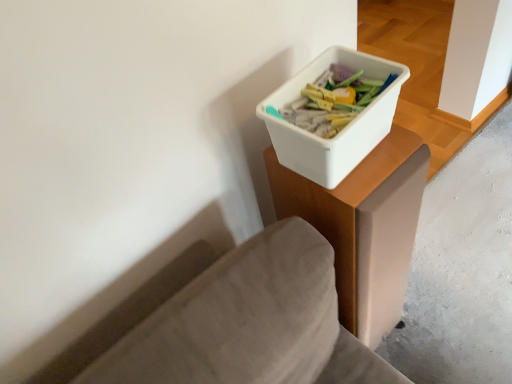
Question: Would you say white plastic container at upper right is a long distance from smooth concrete at lower right?

Choices:
 (A) yes
 (B) no

Answer: (B)

Question: From the image's perspective, is white plastic container at upper right beneath smooth concrete at lower right?

Choices:
 (A) no
 (B) yes

Answer: (B)

Question: From a real-world perspective, does white plastic container at upper right stand above smooth concrete at lower right?

Choices:
 (A) yes
 (B) no

Answer: (A)

Question: Is white plastic container at upper right facing away from smooth concrete at lower right?

Choices:
 (A) yes
 (B) no

Answer: (B)

Question: Considering the relative sizes of white plastic container at upper right and smooth concrete at lower right in the image provided, is white plastic container at upper right smaller than smooth concrete at lower right?

Choices:
 (A) yes
 (B) no

Answer: (B)

Question: Is white plastic container at upper right positioned in front of smooth concrete at lower right?

Choices:
 (A) no
 (B) yes

Answer: (B)

Question: From a real-world perspective, is smooth concrete at lower right physically above white plastic container at upper right?

Choices:
 (A) no
 (B) yes

Answer: (A)

Question: Is smooth concrete at lower right behind white plastic container at upper right?

Choices:
 (A) no
 (B) yes

Answer: (B)

Question: From the image's perspective, would you say smooth concrete at lower right is positioned over white plastic container at upper right?

Choices:
 (A) no
 (B) yes

Answer: (A)

Question: Considering the relative sizes of smooth concrete at lower right and white plastic container at upper right in the image provided, is smooth concrete at lower right shorter than white plastic container at upper right?

Choices:
 (A) no
 (B) yes

Answer: (B)

Question: Is white plastic container at upper right a part of smooth concrete at lower right?

Choices:
 (A) no
 (B) yes

Answer: (A)

Question: Can you confirm if smooth concrete at lower right is wider than white plastic container at upper right?

Choices:
 (A) yes
 (B) no

Answer: (A)

Question: Is white plastic container at upper right bigger than white plastic container at upper right?

Choices:
 (A) no
 (B) yes

Answer: (A)